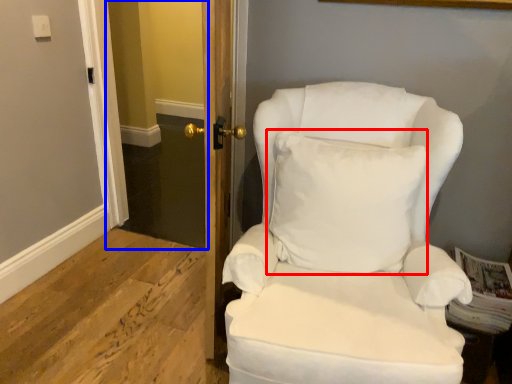
Question: Which object is further to the camera taking this photo, pillow (highlighted by a red box) or glass door (highlighted by a blue box)?

Choices:
 (A) pillow
 (B) glass door

Answer: (B)